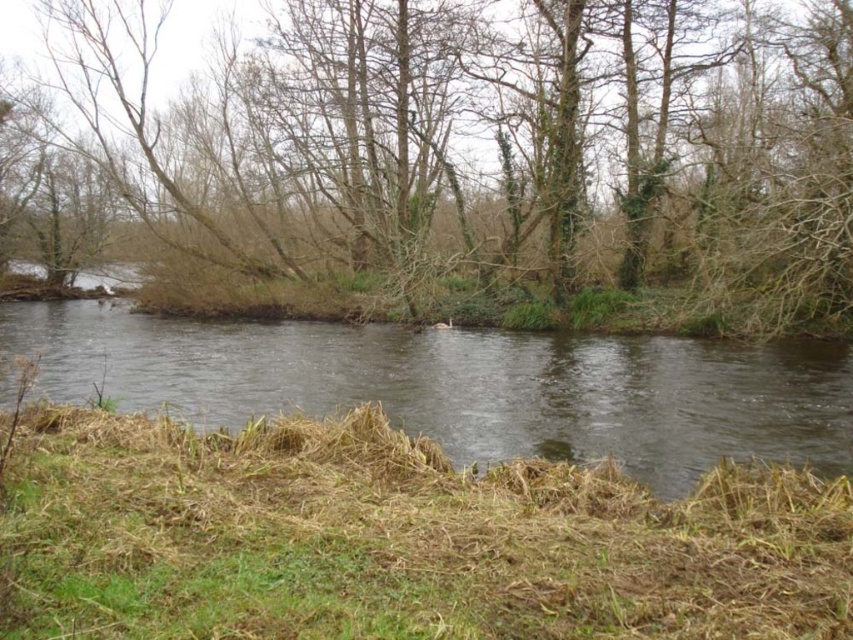
You are a hiker who wants to cross the river using the brown dry grass at lower center and the clear water at center as landmarks. Which landmark is narrower in width?

The brown dry grass at lower center is thinner than the clear water at center, so the brown dry grass at lower center is narrower in width.

You are a hiker trying to cross the river using the area shown in the image. Considering the brown dry grass at lower center and the clear water at center, which area would provide a more stable footing? Please explain your reasoning based on their spatial relationship.

The brown dry grass at lower center occupies less space than the clear water at center, so the clear water at center has a larger area. However, the dry grass is more stable for footing because it is solid ground, while the water is fluid and may be deeper in the center where it is clear, making it less stable.

You are standing on the riverbank and want to throw a pebble to see where it lands. If you throw it towards the brown leafless tree at center, how far will it travel before hitting the water?

The brown leafless tree at center is 18.46 meters away from you, so the pebble will travel approximately 18.46 meters before hitting the water.